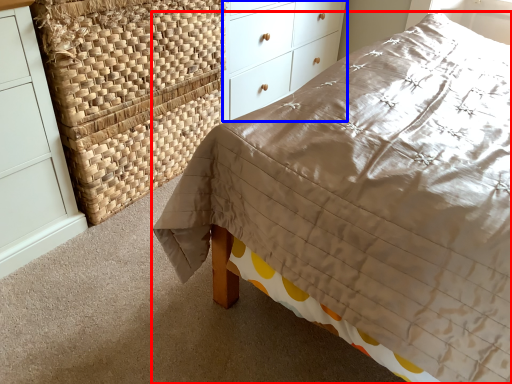
Question: Which object is further to the camera taking this photo, bed (highlighted by a red box) or chest of drawers (highlighted by a blue box)?

Choices:
 (A) bed
 (B) chest of drawers

Answer: (B)